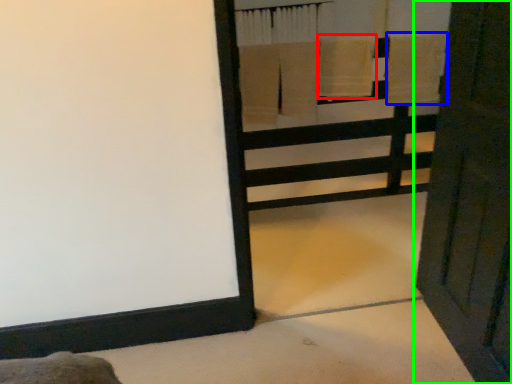
Question: Based on their relative distances, which object is farther from bath towel (highlighted by a red box)? Choose from bath towel (highlighted by a blue box) and door (highlighted by a green box).

Choices:
 (A) bath towel
 (B) door

Answer: (B)